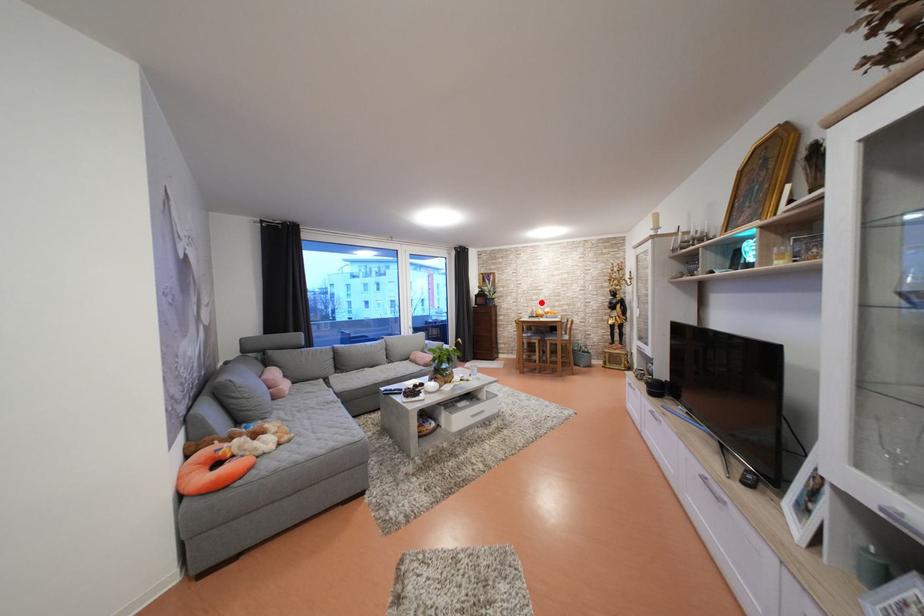
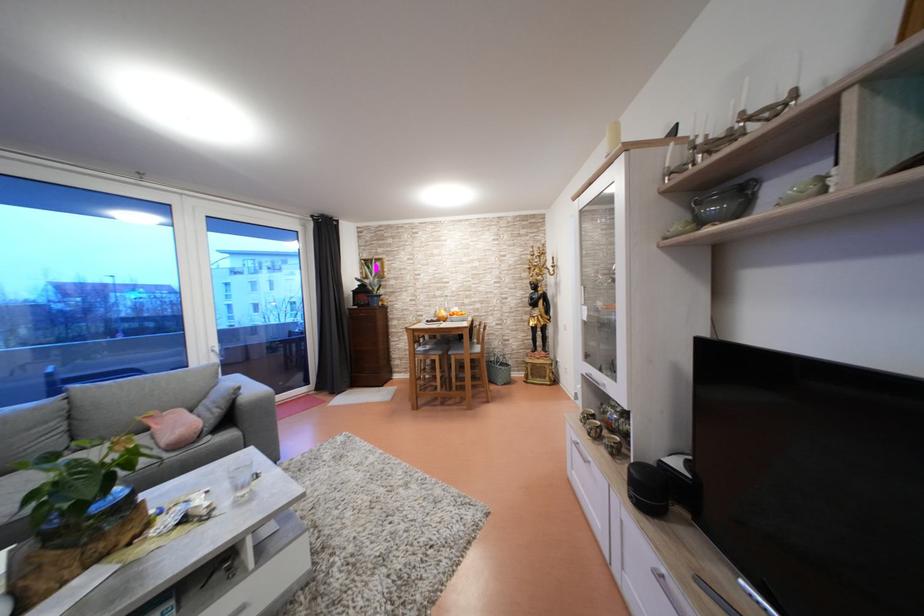
The point at the highlighted location is marked in the first image. Where is the corresponding point in the second image?

(444, 299)